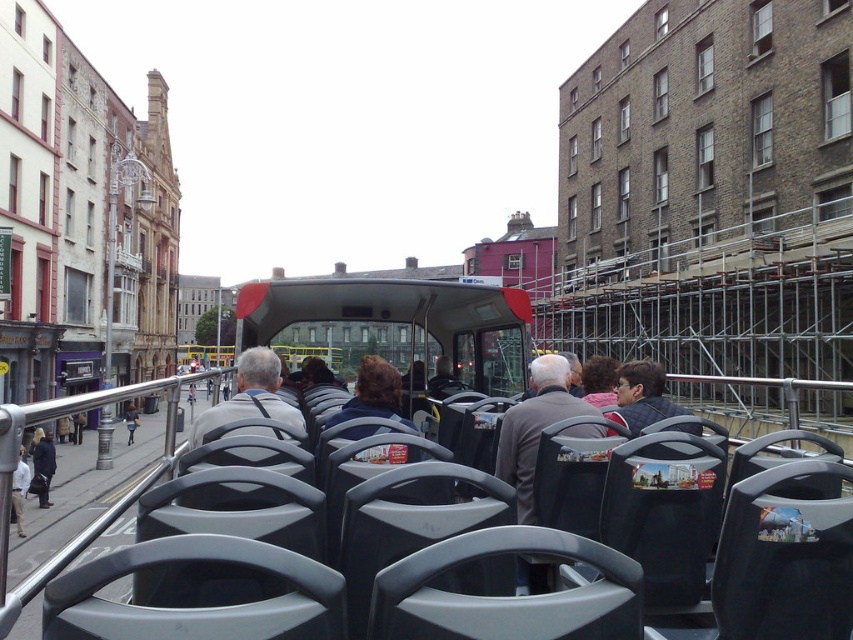
Question: Does matte gray bus at center have a lesser width compared to gray fabric jacket at center?

Choices:
 (A) yes
 (B) no

Answer: (B)

Question: Which of these objects is positioned farthest from the gray fabric jacket at center?

Choices:
 (A) matte gray bus at center
 (B) dark blue jacket at center

Answer: (B)

Question: Which of the following is the closest to the observer?

Choices:
 (A) gray fabric jacket at center
 (B) dark blue jacket at center
 (C) matte gray bus at center

Answer: (A)

Question: Which of the following is the closest to the observer?

Choices:
 (A) (494, 364)
 (B) (41, 442)

Answer: (A)

Question: Is gray fabric jacket at center thinner than dark blue jacket at center?

Choices:
 (A) no
 (B) yes

Answer: (A)

Question: Does matte gray bus at center have a lesser width compared to gray fabric jacket at center?

Choices:
 (A) no
 (B) yes

Answer: (A)